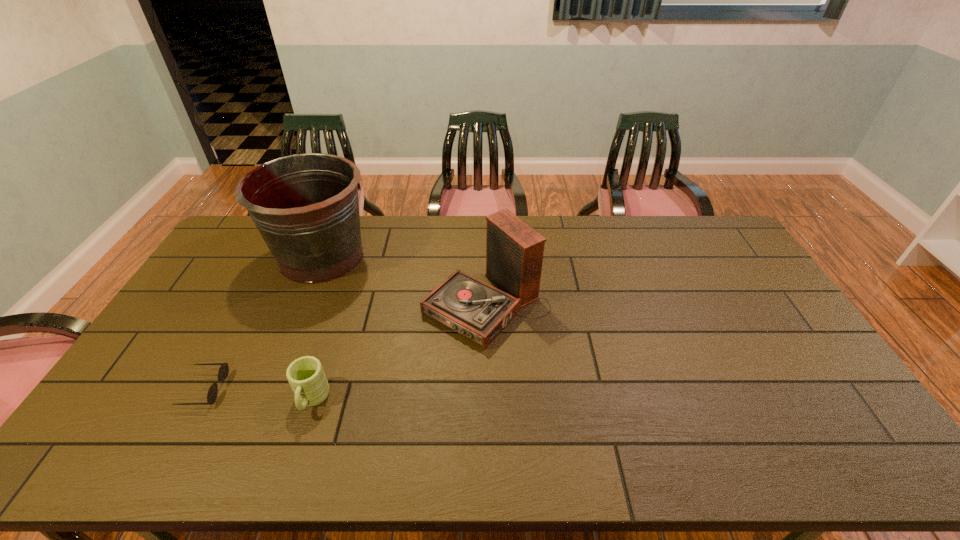
The image size is (960, 540). Find the location of `vacant space at the far edge of the desktop`. vacant space at the far edge of the desktop is located at coordinates (622, 227).

In the image, there is a desktop. At what (x,y) coordinates should I click in order to perform the action: click on free space at the near edge. Please return your answer as a coordinate pair (x, y). This screenshot has height=540, width=960. Looking at the image, I should click on (388, 449).

Where is `vacant area at the left edge`? vacant area at the left edge is located at coordinates (205, 271).

In the image, there is a desktop. In order to click on vacant space at the right edge in this screenshot , I will do `click(815, 373)`.

Where is `vacant area that lies between the bucket and the second shortest object`? vacant area that lies between the bucket and the second shortest object is located at coordinates (317, 328).

This screenshot has height=540, width=960. Identify the location of vacant region between the shortest object and the rightmost object. (346, 347).

Identify the location of free space between the second tallest object and the sunglasses. This screenshot has height=540, width=960. (346, 347).

Locate an element on the screen. This screenshot has width=960, height=540. empty location between the second shortest object and the tallest object is located at coordinates (317, 328).

I want to click on vacant region between the shortest object and the bucket, so click(263, 322).

Locate an element on the screen. The image size is (960, 540). free space between the bucket and the phonograph record is located at coordinates (404, 280).